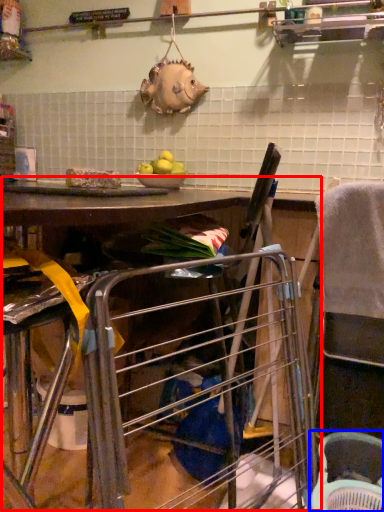
Question: Which object appears closest to the camera in this image, workbench (highlighted by a red box) or basket (highlighted by a blue box)?

Choices:
 (A) workbench
 (B) basket

Answer: (A)